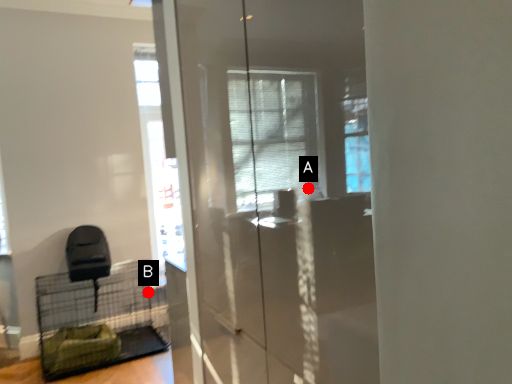
Question: Two points are circled on the image, labeled by A and B beside each circle. Which point appears closest to the camera in this image?

Choices:
 (A) A is closer
 (B) B is closer

Answer: (A)